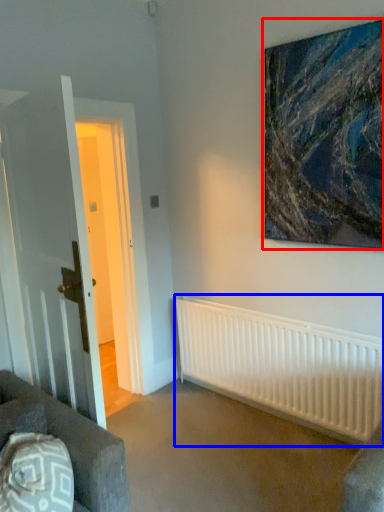
Question: Which point is closer to the camera, picture frame (highlighted by a red box) or radiator (highlighted by a blue box)?

Choices:
 (A) picture frame
 (B) radiator

Answer: (A)